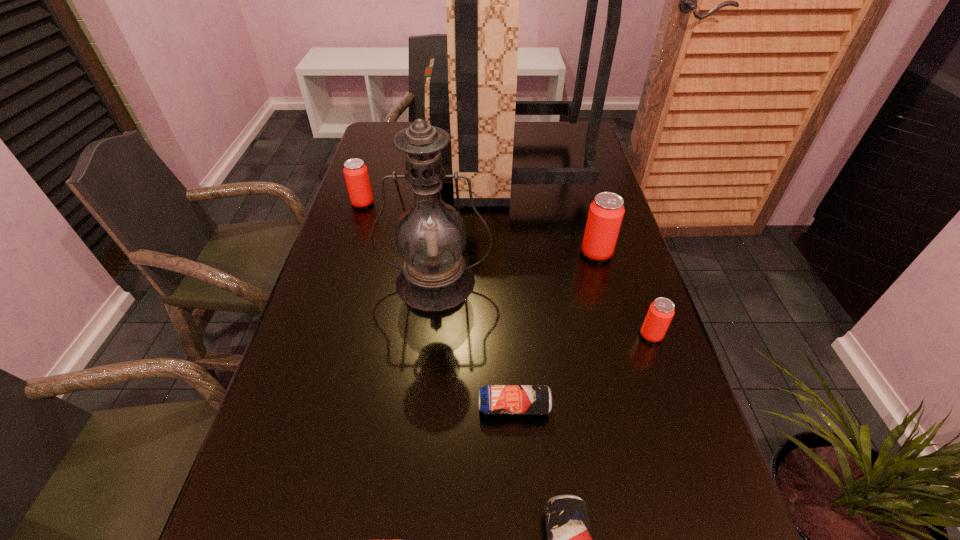
Where is `backpack`? The width and height of the screenshot is (960, 540). backpack is located at coordinates (471, 94).

The height and width of the screenshot is (540, 960). Find the location of `the sixth shortest object`. the sixth shortest object is located at coordinates (430, 235).

At what (x,y) coordinates should I click in order to perform the action: click on oil lamp. Please return your answer as a coordinate pair (x, y). This screenshot has height=540, width=960. Looking at the image, I should click on (430, 235).

This screenshot has height=540, width=960. In order to click on the second farthest red beer can in this screenshot , I will do `click(606, 212)`.

The height and width of the screenshot is (540, 960). Find the location of `the biggest red beer can`. the biggest red beer can is located at coordinates (606, 212).

The height and width of the screenshot is (540, 960). Identify the location of the second tallest beer can. (355, 171).

Where is `the fourth tallest object`? Image resolution: width=960 pixels, height=540 pixels. the fourth tallest object is located at coordinates (355, 171).

Find the location of a particular element. the rightmost object is located at coordinates (660, 313).

I want to click on the rightmost beer can, so click(x=660, y=313).

In order to click on the farther blue beer can in this screenshot , I will do `click(493, 399)`.